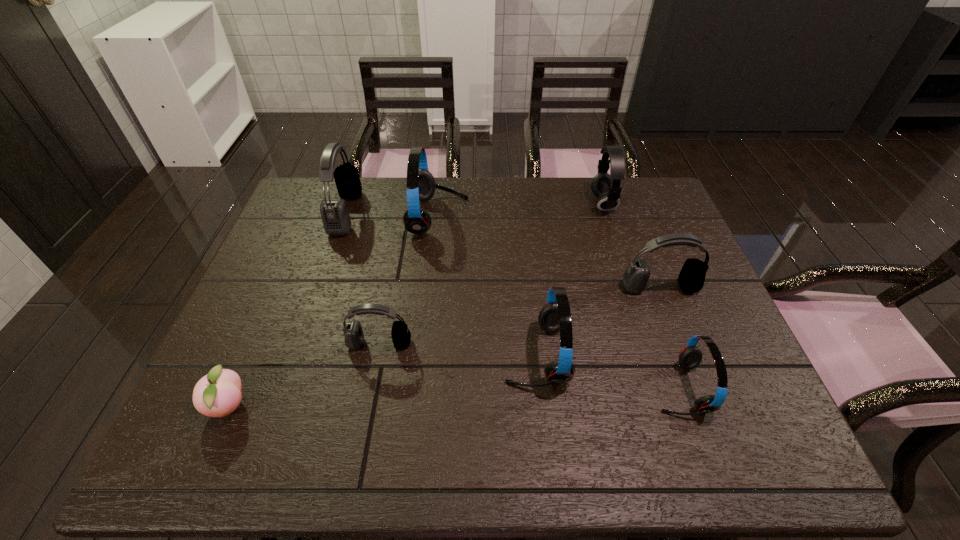
Where is `vacant point located between the biggest red headset and the second biggest red headset`? The height and width of the screenshot is (540, 960). vacant point located between the biggest red headset and the second biggest red headset is located at coordinates (487, 286).

Locate an element on the screen. The image size is (960, 540). empty space that is in between the earphone and the nearest black headset is located at coordinates coord(492,273).

This screenshot has height=540, width=960. Find the location of `blank region between the fifth object from left to right and the rightmost red headset`. blank region between the fifth object from left to right and the rightmost red headset is located at coordinates (608, 371).

In order to click on blank region between the leftmost red headset and the leftmost object in this screenshot , I will do `click(334, 312)`.

In order to click on empty space that is in between the second smallest red headset and the second nearest black headset in this screenshot , I will do `click(598, 321)`.

At what (x,y) coordinates should I click in order to perform the action: click on free space between the smallest black headset and the leftmost object. Please return your answer as a coordinate pair (x, y). Looking at the image, I should click on (304, 375).

Find the location of `vacant space in between the fourth farthest object and the earphone`. vacant space in between the fourth farthest object and the earphone is located at coordinates (632, 245).

Locate an element on the screen. This screenshot has height=540, width=960. vacant space in between the black earphone and the biggest black headset is located at coordinates (474, 208).

Locate an element on the screen. free point between the second smallest red headset and the smallest red headset is located at coordinates (608, 371).

In order to click on empty space between the rightmost black headset and the black earphone in this screenshot , I will do `click(632, 245)`.